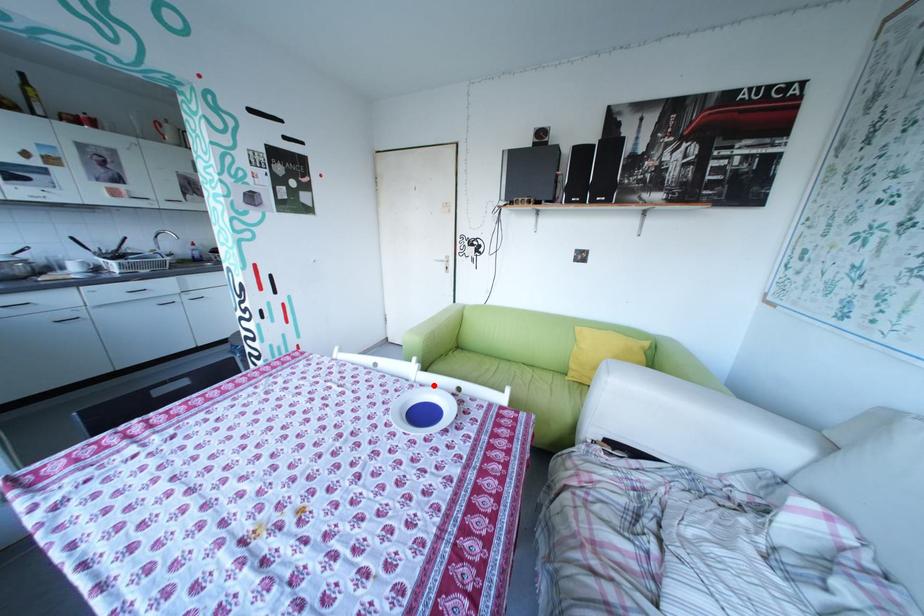
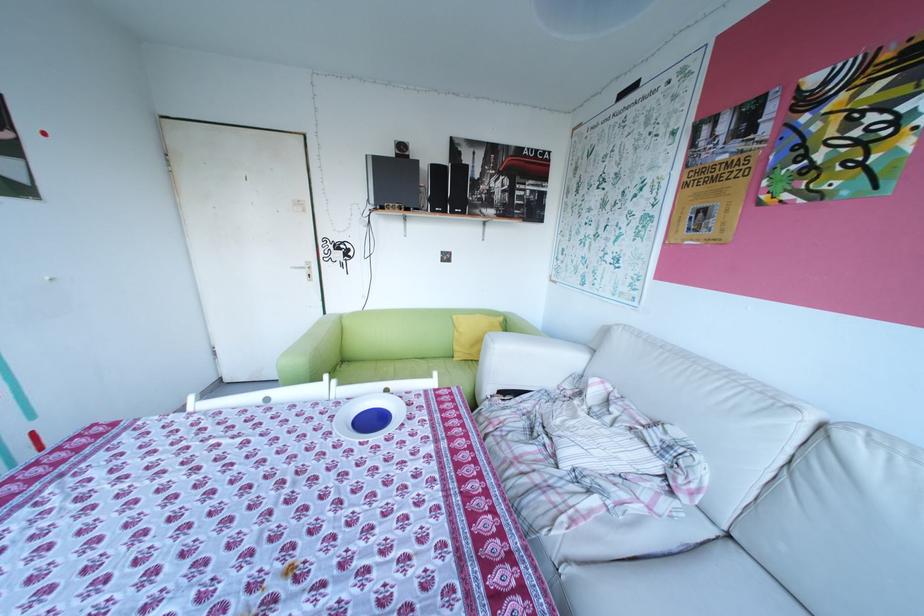
Question: A red point is marked in image1. In image2, is the corresponding 3D point closer to the camera or farther? Reply with the corresponding letter.

Choices:
 (A) The corresponding 3D point is closer.
 (B) The corresponding 3D point is farther.

Answer: (B)